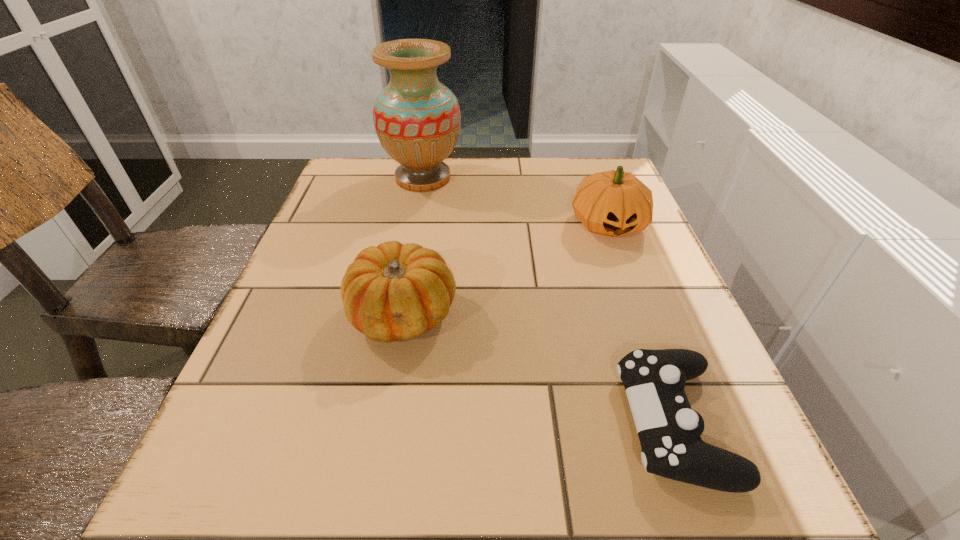
Locate an element on the screen. free space at the near right corner of the desktop is located at coordinates (756, 497).

The width and height of the screenshot is (960, 540). What are the coordinates of `vacant area between the third shortest object and the nearer gourd` in the screenshot? It's located at (506, 269).

Locate an element on the screen. This screenshot has width=960, height=540. vacant point located between the nearest object and the vase is located at coordinates (548, 300).

Find the location of a particular element. unoccupied area between the third tallest object and the nearest object is located at coordinates (539, 368).

Locate an element on the screen. Image resolution: width=960 pixels, height=540 pixels. free point between the third nearest object and the nearest object is located at coordinates (641, 323).

Locate an element on the screen. This screenshot has width=960, height=540. empty space that is in between the right gourd and the vase is located at coordinates (516, 201).

Locate an element on the screen. The height and width of the screenshot is (540, 960). vacant area that lies between the nearest object and the farthest object is located at coordinates (548, 300).

Locate an element on the screen. free space between the third tallest object and the nearest object is located at coordinates (539, 368).

The image size is (960, 540). I want to click on blank region between the control and the vase, so coord(548,300).

Locate an element on the screen. The height and width of the screenshot is (540, 960). vacant region between the vase and the second farthest object is located at coordinates (516, 201).